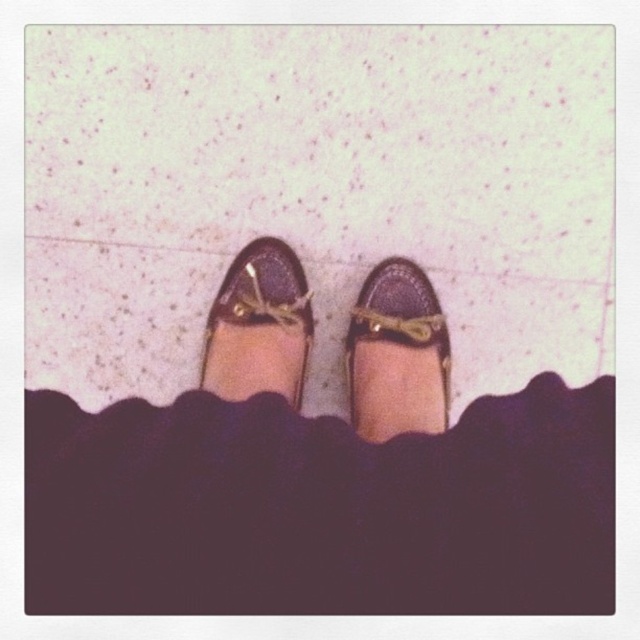
You are a tailor measuring the distance between two shoes for a custom fitting. The shiny brown shoes at center and the matte brown leather shoe at center must be placed on a display stand. Can the two shoes be placed 16.35 inches apart on the stand?

Yes, the two shoes can be placed 16.35 inches apart on the display stand since the distance between the shiny brown shoes at center and the matte brown leather shoe at center is exactly 16.35 inches.

You are trying to determine the order of the shiny brown shoes at center and the matte brown loafer at center from your perspective. Which one is closer to you?

The shiny brown shoes at center is closer to you because it is in front of the matte brown loafer at center.